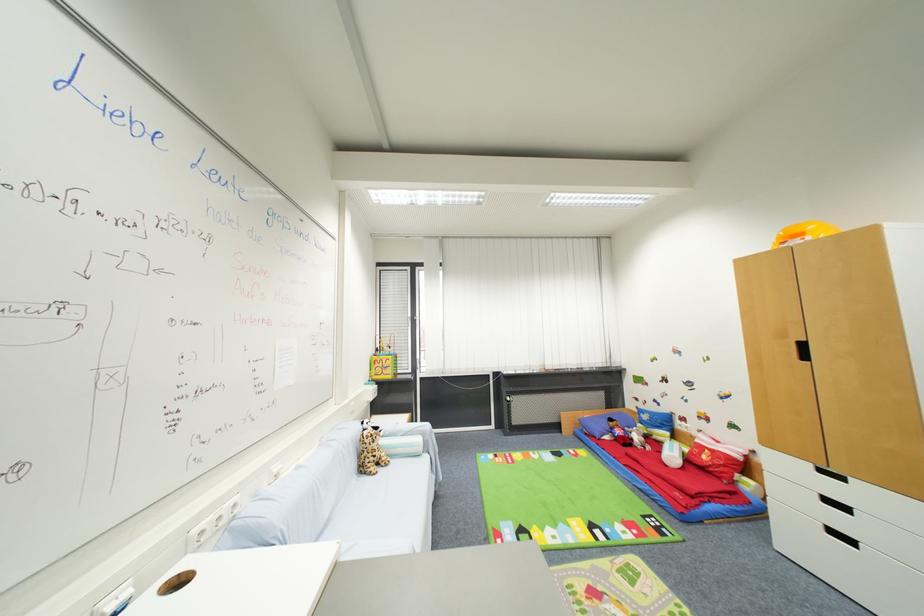
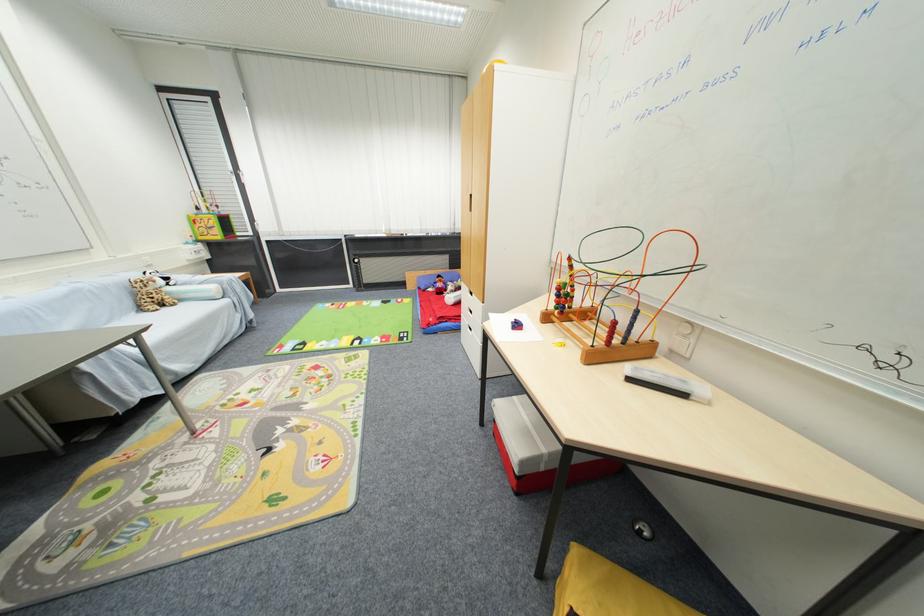
Where in the second image is the point corresponding to pixel 367 472 from the first image?

(146, 310)